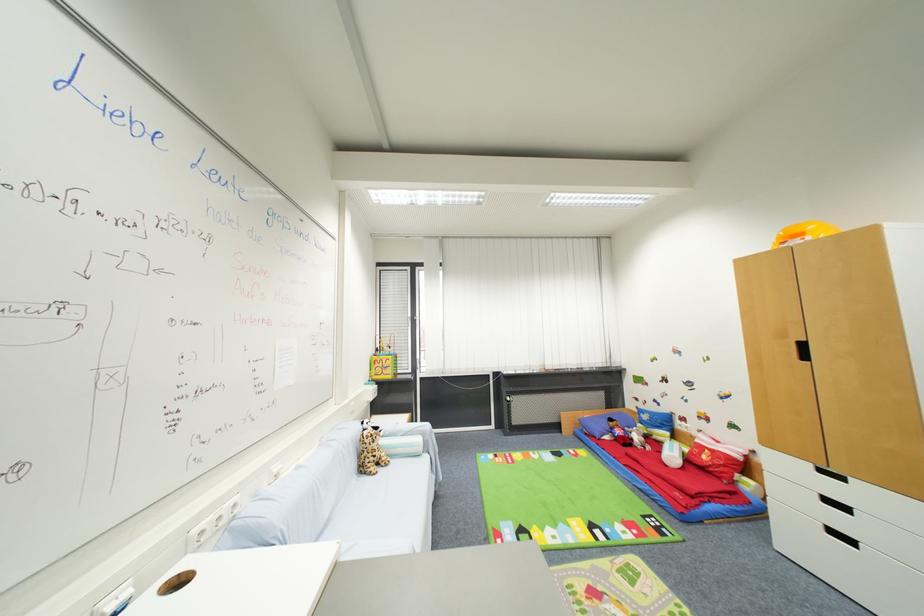
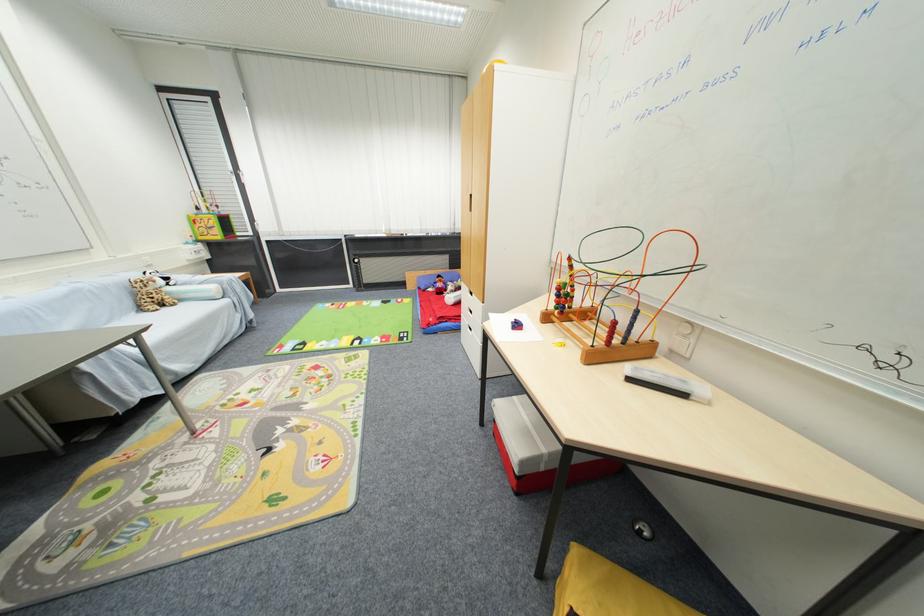
Where in the second image is the point corresponding to pixel 367 472 from the first image?

(146, 310)